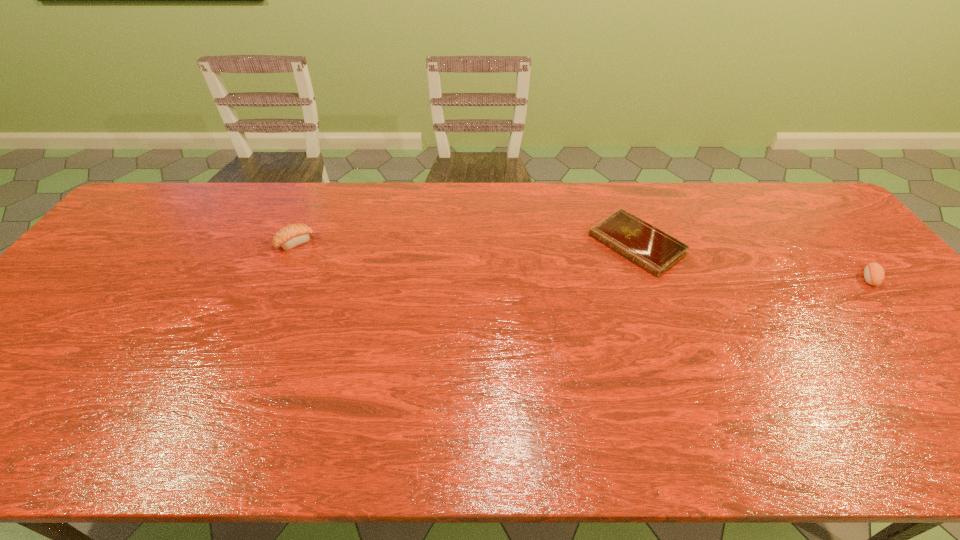
The image size is (960, 540). In order to click on the leftmost object in this screenshot , I will do [x=293, y=235].

Image resolution: width=960 pixels, height=540 pixels. In order to click on the farther sushi in this screenshot , I will do `click(293, 235)`.

At what (x,y) coordinates should I click in order to perform the action: click on the right sushi. Please return your answer as a coordinate pair (x, y). Image resolution: width=960 pixels, height=540 pixels. Looking at the image, I should click on click(x=874, y=274).

What are the coordinates of `the rightmost object` in the screenshot? It's located at (874, 274).

Find the location of a particular element. The height and width of the screenshot is (540, 960). the second object from right to left is located at coordinates (650, 248).

The image size is (960, 540). I want to click on notebook, so click(x=650, y=248).

The width and height of the screenshot is (960, 540). I want to click on vacant space positioned on the back of the left sushi, so click(x=311, y=207).

Identify the location of free space located on the left of the nearer sushi. The height and width of the screenshot is (540, 960). (729, 278).

I want to click on free point located 0.360m on the front of the second object from left to right, so click(693, 396).

Where is `object that is at the far edge`? This screenshot has height=540, width=960. object that is at the far edge is located at coordinates (650, 248).